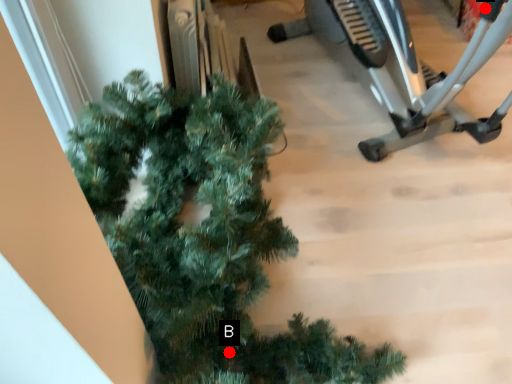
Question: Two points are circled on the image, labeled by A and B beside each circle. Which point is closer to the camera?

Choices:
 (A) A is closer
 (B) B is closer

Answer: (B)